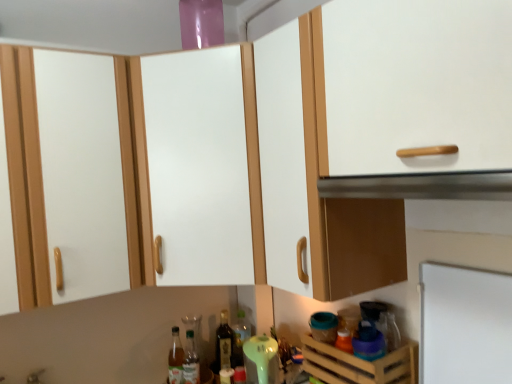
Question: Is shiny dark glass bottle at center, which is the 2th bottle from left to right, taller than white matte cabinet at center?

Choices:
 (A) yes
 (B) no

Answer: (B)

Question: Is shiny dark glass bottle at center, which is the 2th bottle from left to right, facing towards white matte cabinet at center?

Choices:
 (A) yes
 (B) no

Answer: (B)

Question: Considering the relative positions of shiny dark glass bottle at center, placed as the second bottle when sorted from right to left, and white matte cabinet at center in the image provided, is shiny dark glass bottle at center, placed as the second bottle when sorted from right to left, in front of white matte cabinet at center?

Choices:
 (A) yes
 (B) no

Answer: (B)

Question: Is shiny dark glass bottle at center, which is the 2th bottle from left to right, positioned behind white matte cabinet at center?

Choices:
 (A) no
 (B) yes

Answer: (B)

Question: Does shiny dark glass bottle at center, placed as the second bottle when sorted from right to left, appear on the right side of white matte cabinet at center?

Choices:
 (A) no
 (B) yes

Answer: (B)

Question: Is wooden crate at lower right inside or outside of translucent glass bottle at center, which is counted as the 1th bottle, starting from the right?

Choices:
 (A) inside
 (B) outside

Answer: (B)

Question: Considering their positions, is wooden crate at lower right located in front of or behind translucent glass bottle at center, which is counted as the 1th bottle, starting from the right?

Choices:
 (A) behind
 (B) front

Answer: (B)

Question: From a real-world perspective, is wooden crate at lower right above or below translucent glass bottle at center, acting as the third bottle starting from the left?

Choices:
 (A) below
 (B) above

Answer: (B)

Question: Considering the positions of point (345, 369) and point (236, 326), is point (345, 369) closer or farther from the camera than point (236, 326)?

Choices:
 (A) farther
 (B) closer

Answer: (B)

Question: In terms of width, does shiny dark glass bottle at center, placed as the second bottle when sorted from right to left, look wider or thinner when compared to metallic silver vent at upper center?

Choices:
 (A) thin
 (B) wide

Answer: (A)

Question: Considering the positions of shiny dark glass bottle at center, which is the 2th bottle from left to right, and metallic silver vent at upper center in the image, is shiny dark glass bottle at center, which is the 2th bottle from left to right, taller or shorter than metallic silver vent at upper center?

Choices:
 (A) short
 (B) tall

Answer: (B)

Question: In terms of size, does shiny dark glass bottle at center, which is the 2th bottle from left to right, appear bigger or smaller than metallic silver vent at upper center?

Choices:
 (A) small
 (B) big

Answer: (A)

Question: Would you say shiny dark glass bottle at center, placed as the second bottle when sorted from right to left, is to the left or to the right of metallic silver vent at upper center in the picture?

Choices:
 (A) right
 (B) left

Answer: (B)

Question: Relative to translucent glass bottle at center, acting as the third bottle starting from the left, is shiny dark glass bottle at center, which is the 2th bottle from left to right, in front or behind?

Choices:
 (A) behind
 (B) front

Answer: (B)

Question: Based on their positions, is shiny dark glass bottle at center, which is the 2th bottle from left to right, located to the left or right of translucent glass bottle at center, which is counted as the 1th bottle, starting from the right?

Choices:
 (A) right
 (B) left

Answer: (B)